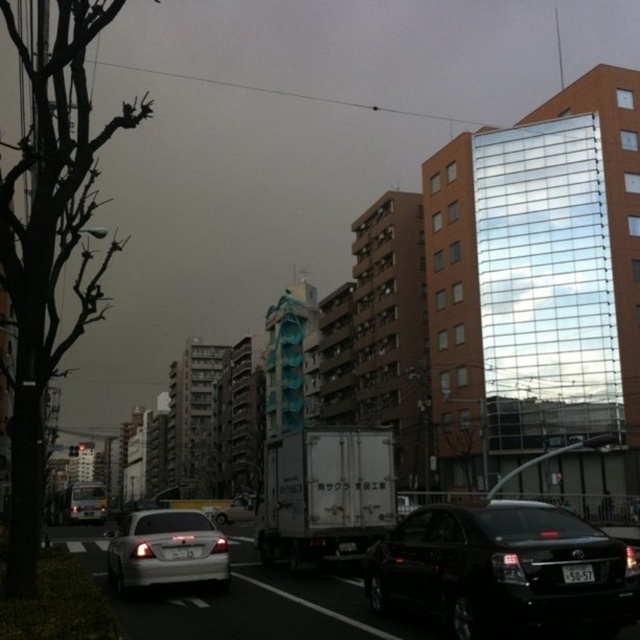
Between silver metallic car at center and white plastic license plate at center, which one has less height?

white plastic license plate at center is shorter.

Does silver metallic car at center have a greater width compared to white plastic license plate at center?

Yes, silver metallic car at center is wider than white plastic license plate at center.

The image size is (640, 640). What are the coordinates of `silver metallic car at center` in the screenshot? It's located at (236, 512).

This screenshot has width=640, height=640. I want to click on silver metallic car at center, so click(x=236, y=512).

Between satin silver sedan at center and silver metallic car at center, which one appears on the left side from the viewer's perspective?

silver metallic car at center

Can you confirm if satin silver sedan at center is bigger than silver metallic car at center?

Yes, satin silver sedan at center is bigger than silver metallic car at center.

Where is `satin silver sedan at center`? The image size is (640, 640). satin silver sedan at center is located at coordinates (164, 548).

Does brown leafless tree at left have a lesser width compared to black plastic license plate at center?

No.

Can you confirm if brown leafless tree at left is wider than black plastic license plate at center?

Yes.

Describe the element at coordinates (51, 243) in the screenshot. This screenshot has width=640, height=640. I see `brown leafless tree at left` at that location.

Locate an element on the screen. This screenshot has height=640, width=640. brown leafless tree at left is located at coordinates (51, 243).